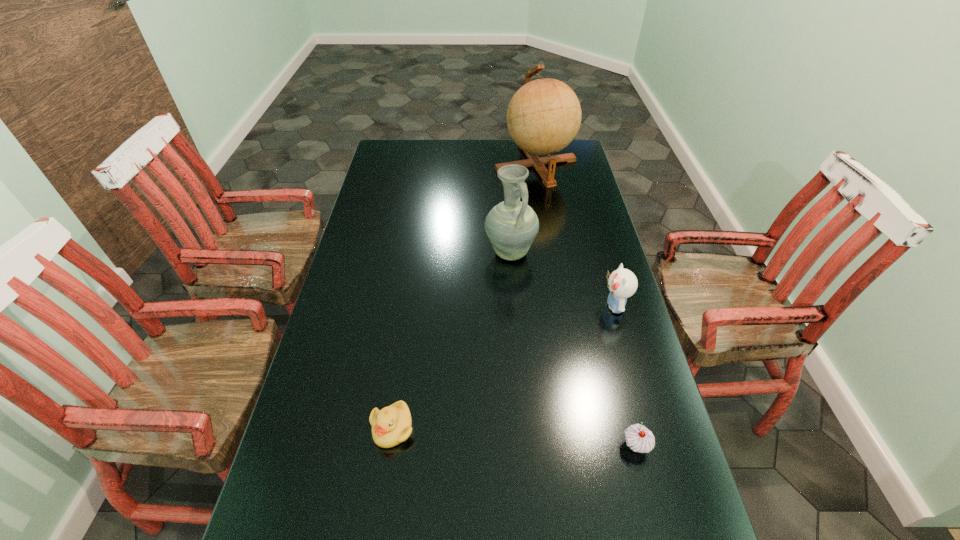
You are a GUI agent. You are given a task and a screenshot of the screen. Output one action in this format:
    pyautogui.click(x=<x>, y=<y>)
    Task: Click on the free region located on the handle side of the second farthest object
    Image resolution: width=960 pixels, height=540 pixels.
    Given the screenshot: What is the action you would take?
    pyautogui.click(x=519, y=379)

The image size is (960, 540). I want to click on vacant space positioned on the front-facing side of the kitten, so click(560, 306).

At what (x,y) coordinates should I click in order to perform the action: click on free location located on the front-facing side of the kitten. Please return your answer as a coordinate pair (x, y). Looking at the image, I should click on (523, 306).

The image size is (960, 540). In order to click on vacant space located on the front-facing side of the kitten in this screenshot , I will do `click(557, 306)`.

Where is `free space located on the left of the cupcake`? The width and height of the screenshot is (960, 540). free space located on the left of the cupcake is located at coordinates (556, 446).

The height and width of the screenshot is (540, 960). Find the location of `free space located on the front-facing side of the shortest object`. free space located on the front-facing side of the shortest object is located at coordinates (386, 472).

You are a GUI agent. You are given a task and a screenshot of the screen. Output one action in this format:
    pyautogui.click(x=<x>, y=<y>)
    Task: Click on the object located in the far edge section of the desktop
    This screenshot has height=540, width=960.
    Given the screenshot: What is the action you would take?
    pyautogui.click(x=543, y=117)

Where is `globe at the right edge`? This screenshot has width=960, height=540. globe at the right edge is located at coordinates (543, 117).

The image size is (960, 540). What are the coordinates of `kitten that is positioned at the right edge` in the screenshot? It's located at (622, 283).

At what (x,y) coordinates should I click in order to perform the action: click on cupcake that is positioned at the right edge. Please return your answer as a coordinate pair (x, y). Looking at the image, I should click on (638, 438).